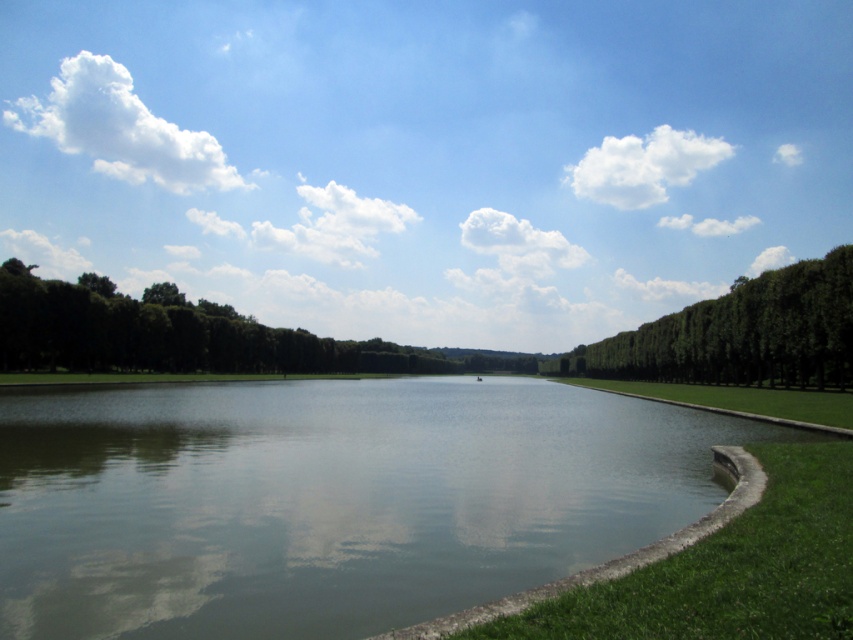
Question: Which object appears closest to the camera in this image?

Choices:
 (A) green leafy trees at upper right
 (B) green grassy lake at center

Answer: (B)

Question: Can you confirm if green leafy trees at upper right is positioned to the left of green grass at right?

Choices:
 (A) yes
 (B) no

Answer: (B)

Question: Among these objects, which one is farthest from the camera?

Choices:
 (A) green leafy trees at upper right
 (B) green grassy lake at center

Answer: (A)

Question: Is green grassy lake at center bigger than green leafy trees at upper right?

Choices:
 (A) no
 (B) yes

Answer: (A)

Question: Which point is closer to the camera?

Choices:
 (A) (726, 392)
 (B) (817, 276)
 (C) (76, 554)

Answer: (C)

Question: Does green grassy lake at center have a larger size compared to green leafy trees at upper right?

Choices:
 (A) yes
 (B) no

Answer: (B)